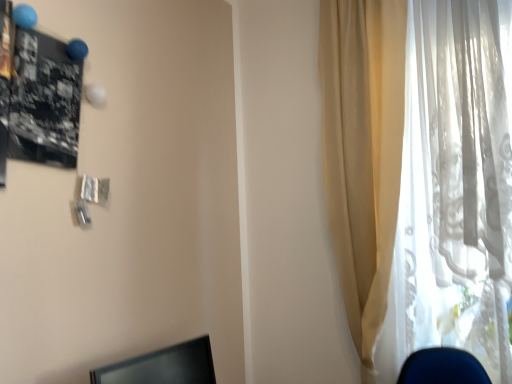
Locate an element on the screen. The width and height of the screenshot is (512, 384). translucent white curtain at right is located at coordinates pos(420,175).

The height and width of the screenshot is (384, 512). Describe the element at coordinates (420, 175) in the screenshot. I see `translucent white curtain at right` at that location.

The image size is (512, 384). What are the coordinates of `black glossy monitor at lower left` in the screenshot? It's located at (163, 366).

What do you see at coordinates (163, 366) in the screenshot? The image size is (512, 384). I see `black glossy monitor at lower left` at bounding box center [163, 366].

Locate an element on the screen. The image size is (512, 384). translucent white curtain at right is located at coordinates (420, 175).

Is translucent white curtain at right to the left or to the right of black glossy monitor at lower left in the image?

translucent white curtain at right is to the right of black glossy monitor at lower left.

Which is behind, translucent white curtain at right or black glossy monitor at lower left?

translucent white curtain at right is behind.

Is point (367, 129) positioned before point (187, 375)?

No, (367, 129) is further to viewer.

From the image's perspective, which one is positioned higher, translucent white curtain at right or black glossy monitor at lower left?

translucent white curtain at right.

From a real-world perspective, who is located higher, translucent white curtain at right or black glossy monitor at lower left?

From a 3D spatial view, translucent white curtain at right is above.

Based on the photo, looking at their sizes, would you say translucent white curtain at right is wider or thinner than black glossy monitor at lower left?

In the image, translucent white curtain at right appears to be wider than black glossy monitor at lower left.

Based on the photo, considering the relative sizes of translucent white curtain at right and black glossy monitor at lower left in the image provided, is translucent white curtain at right taller than black glossy monitor at lower left?

Correct, translucent white curtain at right is much taller as black glossy monitor at lower left.

Considering the sizes of objects translucent white curtain at right and black glossy monitor at lower left in the image provided, who is smaller, translucent white curtain at right or black glossy monitor at lower left?

black glossy monitor at lower left is smaller.

Is translucent white curtain at right inside the boundaries of black glossy monitor at lower left, or outside?

translucent white curtain at right is not inside black glossy monitor at lower left, it's outside.

Is there a large distance between translucent white curtain at right and black glossy monitor at lower left?

No, translucent white curtain at right is in close proximity to black glossy monitor at lower left.

Is translucent white curtain at right oriented away from black glossy monitor at lower left?

That's not correct — translucent white curtain at right is not looking away from black glossy monitor at lower left.

How many degrees apart are the facing directions of translucent white curtain at right and black glossy monitor at lower left?

They differ by 90.5 degrees in their facing directions.

In the image, there is a translucent white curtain at right. At what (x,y) coordinates should I click in order to perform the action: click on desktop below it (from a real-world perspective). Please return your answer as a coordinate pair (x, y). Image resolution: width=512 pixels, height=384 pixels. Looking at the image, I should click on (163, 366).

Can you confirm if black glossy monitor at lower left is positioned to the right of translucent white curtain at right?

No, black glossy monitor at lower left is not to the right of translucent white curtain at right.

Considering the positions of objects black glossy monitor at lower left and translucent white curtain at right in the image provided, who is in front, black glossy monitor at lower left or translucent white curtain at right?

black glossy monitor at lower left is in front.

Which is less distant, (163, 365) or (406, 175)?

Clearly, point (163, 365) is closer to the camera than point (406, 175).

From the image's perspective, which is below, black glossy monitor at lower left or translucent white curtain at right?

black glossy monitor at lower left, from the image's perspective.

From a real-world perspective, which is physically below, black glossy monitor at lower left or translucent white curtain at right?

From a 3D spatial view, black glossy monitor at lower left is below.

In the scene shown: Is black glossy monitor at lower left wider than translucent white curtain at right?

No, black glossy monitor at lower left is not wider than translucent white curtain at right.

Is black glossy monitor at lower left shorter than translucent white curtain at right?

Correct, black glossy monitor at lower left is not as tall as translucent white curtain at right.

Based on the photo, does black glossy monitor at lower left have a larger size compared to translucent white curtain at right?

No.

Is translucent white curtain at right surrounded by black glossy monitor at lower left?

No, translucent white curtain at right is not inside black glossy monitor at lower left.

Is there a large distance between black glossy monitor at lower left and translucent white curtain at right?

No, black glossy monitor at lower left is not far from translucent white curtain at right.

Is black glossy monitor at lower left aimed at translucent white curtain at right?

No, black glossy monitor at lower left is not turned towards translucent white curtain at right.

Based on the photo, can you tell me how much black glossy monitor at lower left and translucent white curtain at right differ in facing direction?

The facing directions of black glossy monitor at lower left and translucent white curtain at right are 90.5 degrees apart.

How much distance is there between black glossy monitor at lower left and translucent white curtain at right?

They are 35.35 inches apart.

The height and width of the screenshot is (384, 512). I want to click on desktop in front of the translucent white curtain at right, so click(x=163, y=366).

Where is `curtain behind the black glossy monitor at lower left`? curtain behind the black glossy monitor at lower left is located at coordinates (420, 175).

Identify the location of curtain that appears above the black glossy monitor at lower left (from a real-world perspective). Image resolution: width=512 pixels, height=384 pixels. (420, 175).